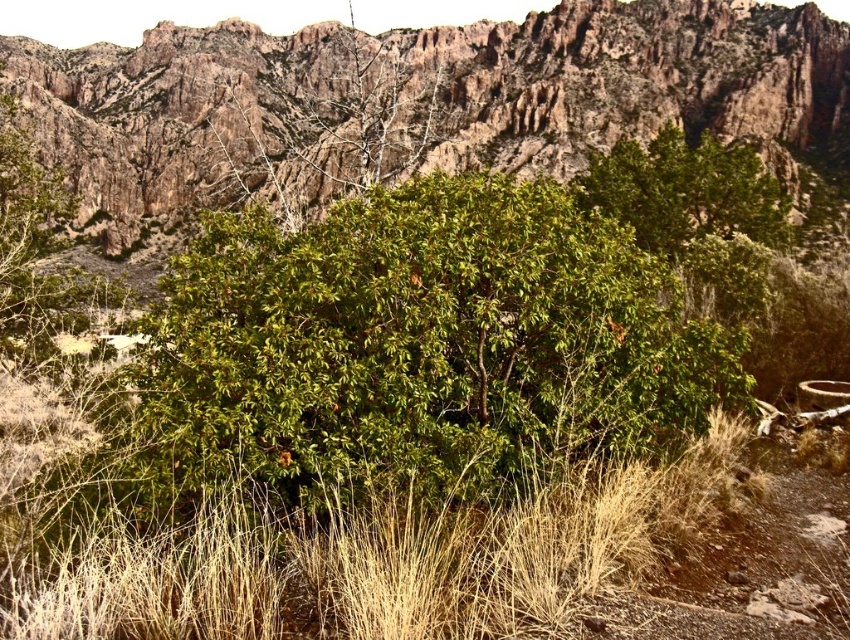
Does point (371, 291) lie behind point (72, 65)?

No, it is not.

You are a GUI agent. You are given a task and a screenshot of the screen. Output one action in this format:
    pyautogui.click(x=<x>, y=<y>)
    Task: Click on the green leafy bush at center
    
    Given the screenshot: What is the action you would take?
    click(420, 348)